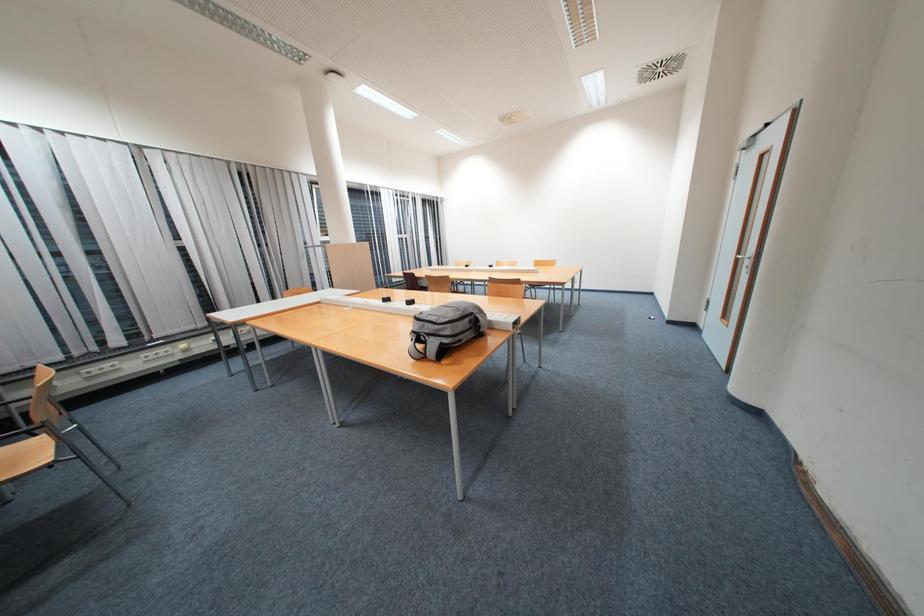
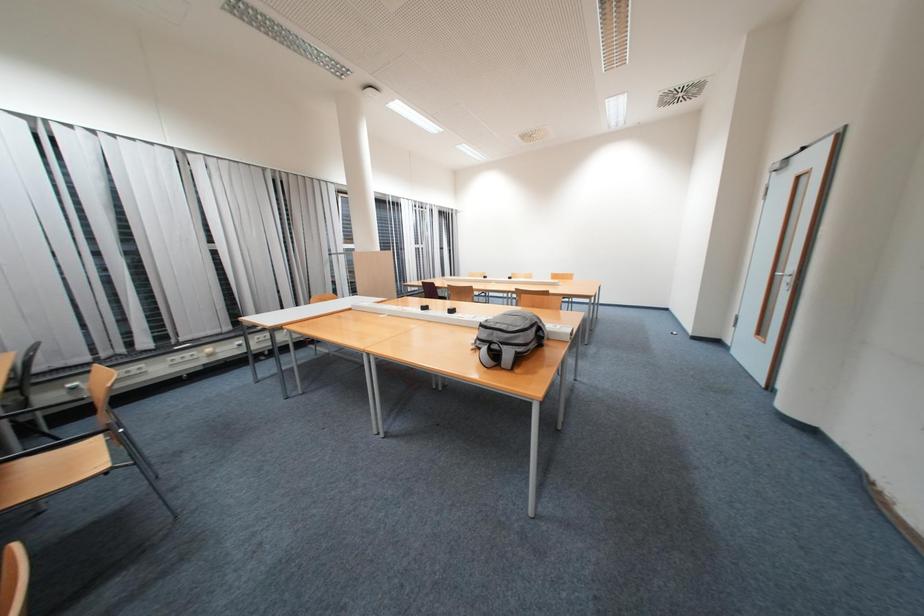
Question: How did the camera likely rotate?

Choices:
 (A) Left
 (B) Right
 (C) Up
 (D) Down

Answer: (C)